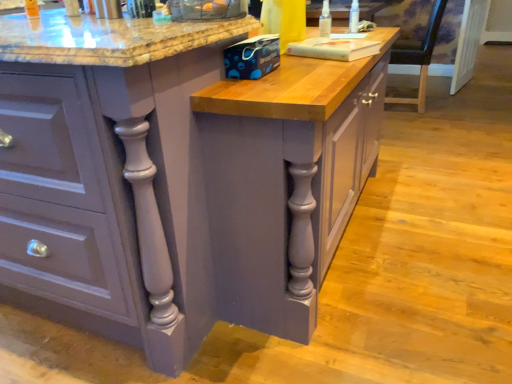
Question: Considering the positions of wooden chair at right and transparent plastic spray bottle at upper right, the 1th bottle in the back-to-front sequence, in the image, is wooden chair at right wider or thinner than transparent plastic spray bottle at upper right, the 1th bottle in the back-to-front sequence,?

Choices:
 (A) thin
 (B) wide

Answer: (B)

Question: In terms of size, does wooden chair at right appear bigger or smaller than transparent plastic spray bottle at upper right, the second bottle in the left-to-right sequence?

Choices:
 (A) big
 (B) small

Answer: (A)

Question: Which is farther from the clear plastic spray bottle at upper right, which ranks as the 1th bottle in left-to-right order?

Choices:
 (A) matte gray cabinet at center
 (B) transparent plastic spray bottle at upper right, which ranks as the 2th bottle in front-to-back order
 (C) wooden chair at right

Answer: (C)

Question: Which is nearer to the matte gray cabinet at center?

Choices:
 (A) transparent plastic spray bottle at upper right, the second bottle in the left-to-right sequence
 (B) clear plastic spray bottle at upper right, the 2th bottle from the back
 (C) wooden chair at right

Answer: (B)